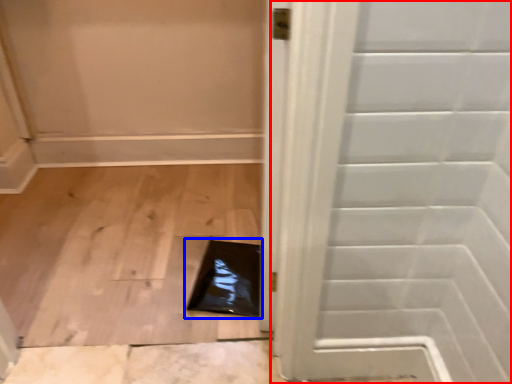
Question: Which object is closer to the camera taking this photo, door (highlighted by a red box) or hole (highlighted by a blue box)?

Choices:
 (A) door
 (B) hole

Answer: (A)